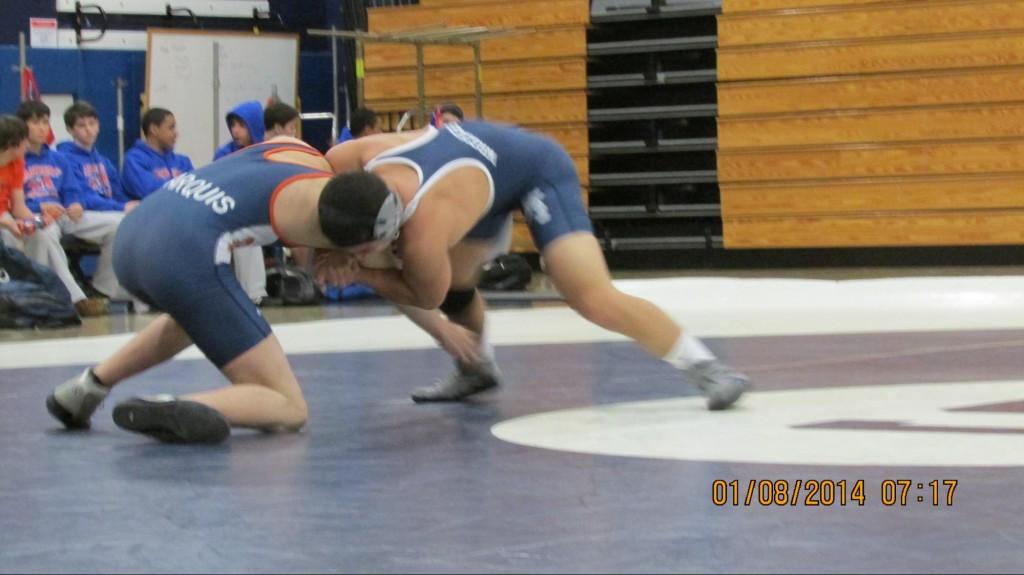
Where is `center mat`? center mat is located at coordinates (801, 428).